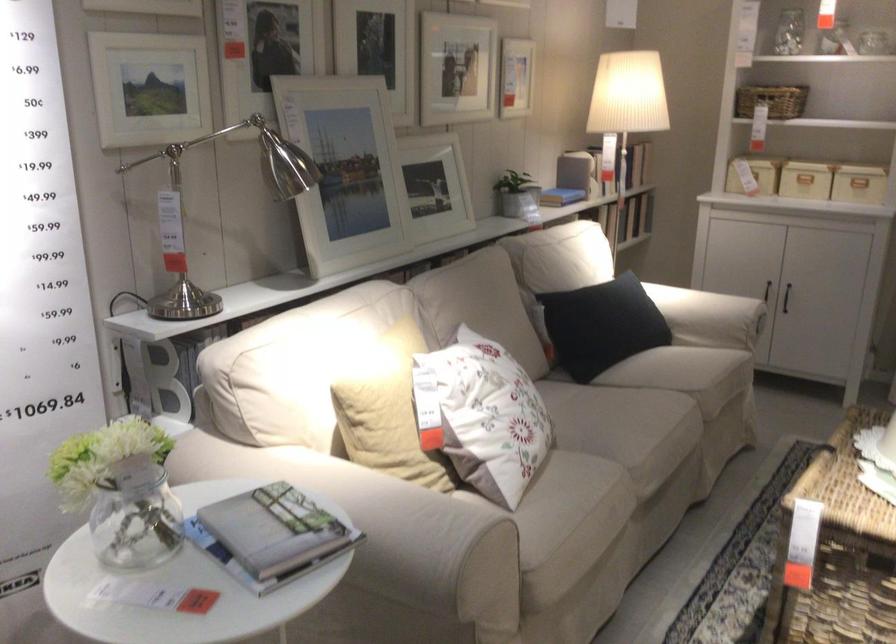
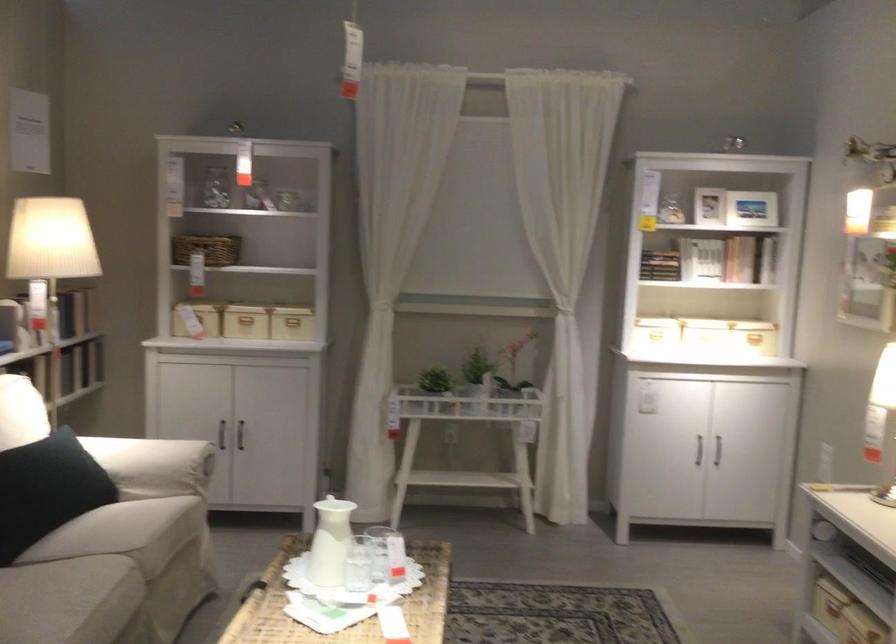
The point at (618, 317) is marked in the first image. Where is the corresponding point in the second image?

(47, 489)